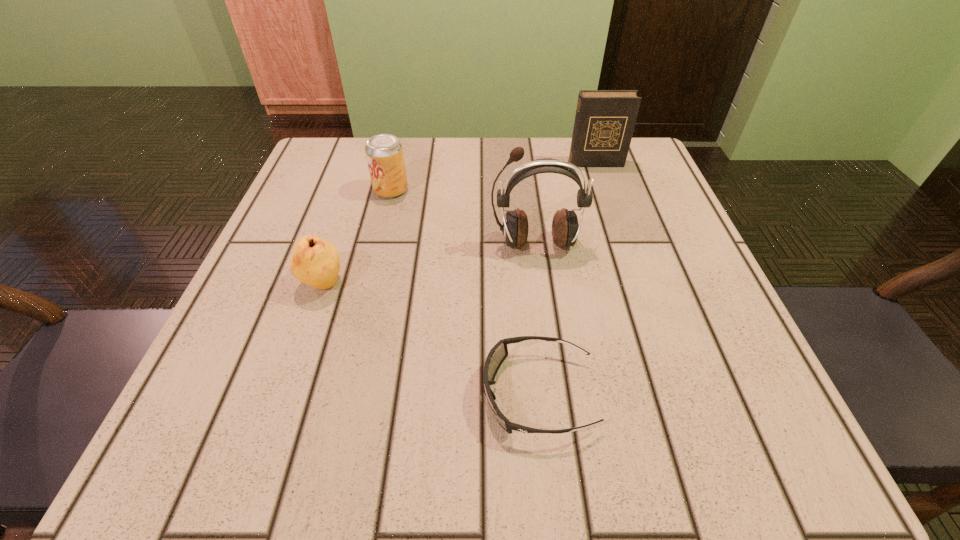
This screenshot has height=540, width=960. Identify the location of blank space located 0.300m on the ear pads of the third nearest object. (559, 420).

Identify the location of vacant region located 0.380m on the front cover of the fourth shortest object. pos(640,296).

The width and height of the screenshot is (960, 540). Find the location of `vacant region located 0.310m on the front of the second farthest object`. vacant region located 0.310m on the front of the second farthest object is located at coordinates (359, 321).

At what (x,y) coordinates should I click in order to perform the action: click on vacant space located on the left of the leftmost object. Please return your answer as a coordinate pair (x, y). This screenshot has height=540, width=960. Looking at the image, I should click on (271, 284).

I want to click on free location located 0.120m on the lenses of the shortest object, so click(393, 394).

Where is `vacant space located 0.170m on the lenses of the shortest object`? The height and width of the screenshot is (540, 960). vacant space located 0.170m on the lenses of the shortest object is located at coordinates (355, 394).

At what (x,y) coordinates should I click in order to perform the action: click on free region located 0.080m on the lenses of the shortest object. Please return your answer as a coordinate pair (x, y). This screenshot has width=960, height=540. Looking at the image, I should click on (422, 394).

Where is `diary present at the far edge`? Image resolution: width=960 pixels, height=540 pixels. diary present at the far edge is located at coordinates (604, 124).

Find the location of `pop (soda) that is at the far edge`. pop (soda) that is at the far edge is located at coordinates (384, 152).

Find the location of `object located at the near edge`. object located at the near edge is located at coordinates tap(497, 355).